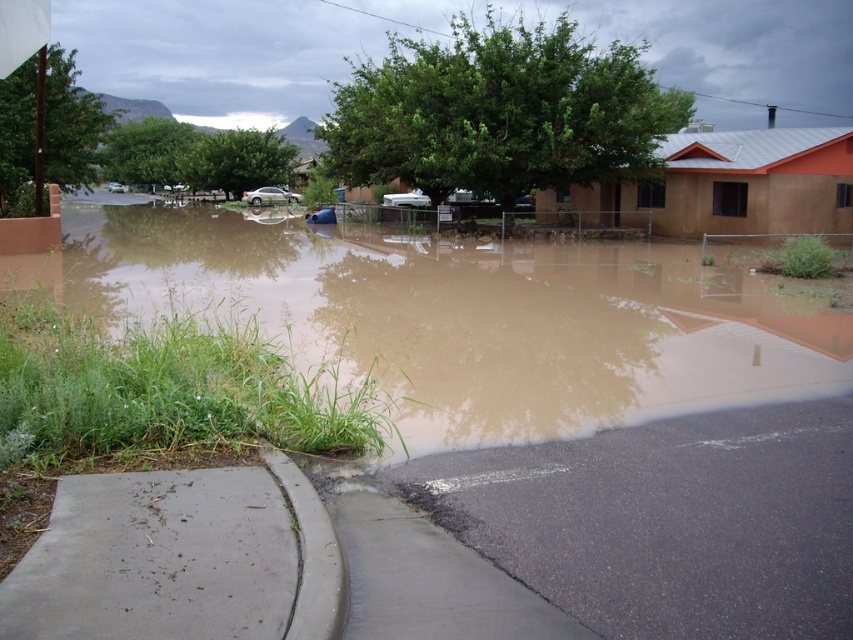
Question: Does brown muddy water at lower left have a lesser width compared to gray concrete curb at lower left?

Choices:
 (A) no
 (B) yes

Answer: (A)

Question: Which object appears farthest from the camera in this image?

Choices:
 (A) gray asphalt at lower center
 (B) gray concrete curb at lower left

Answer: (A)

Question: Is brown muddy water at lower left below gray concrete curb at lower left?

Choices:
 (A) yes
 (B) no

Answer: (B)

Question: Which point is closer to the camera?

Choices:
 (A) (x=653, y=326)
 (B) (x=321, y=516)
 (C) (x=389, y=529)

Answer: (B)

Question: Considering the real-world distances, which object is farthest from the brown muddy water at lower left?

Choices:
 (A) gray concrete curb at lower left
 (B) gray asphalt at lower center

Answer: (A)

Question: Is brown muddy water at lower left below gray asphalt at lower center?

Choices:
 (A) no
 (B) yes

Answer: (A)